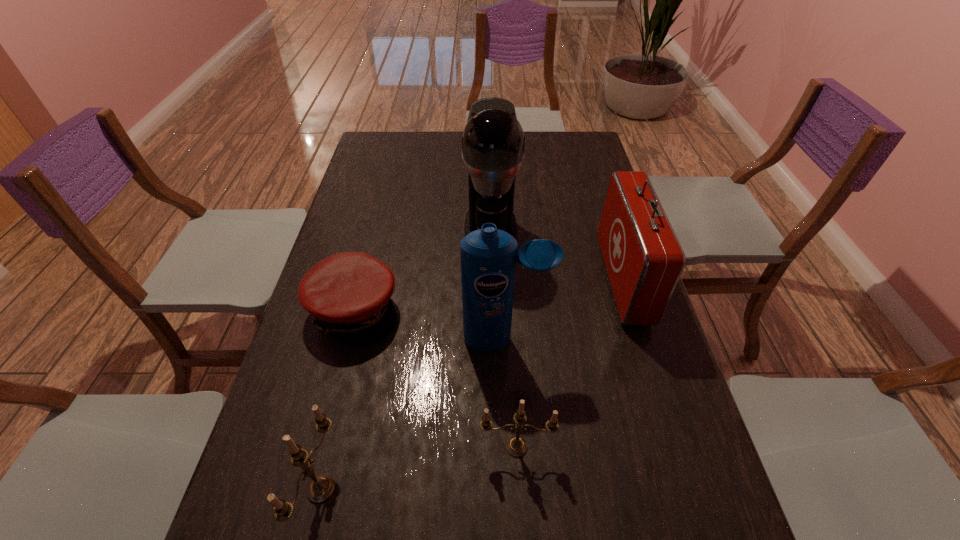
You are a GUI agent. You are given a task and a screenshot of the screen. Output one action in this format:
    pyautogui.click(x=<x>, y=<y>)
    Task: Click on the shorter candle
    The width and height of the screenshot is (960, 540).
    Given the screenshot: What is the action you would take?
    pyautogui.click(x=516, y=446)

Find the location of a particular element. the second shortest object is located at coordinates 516,446.

Where is `coffee maker`? coffee maker is located at coordinates (493, 140).

Find the location of a particular element. This screenshot has width=960, height=540. cap is located at coordinates (348, 293).

This screenshot has height=540, width=960. Find the location of `shampoo`. shampoo is located at coordinates [488, 256].

Locate an element on the screen. The width and height of the screenshot is (960, 540). the fourth shortest object is located at coordinates (644, 260).

You are a GUI agent. You are given a task and a screenshot of the screen. Output one action in this format:
    pyautogui.click(x=<x>, y=<y>)
    Task: Click on the rightmost object
    Image resolution: width=960 pixels, height=540 pixels.
    Given the screenshot: What is the action you would take?
    pyautogui.click(x=644, y=260)

What are the coordinates of `blank space located 0.190m on the left of the right candle` in the screenshot? It's located at (387, 447).

Find the location of a particular element. blank space located place cup under the spout of the coffee maker is located at coordinates (493, 350).

The image size is (960, 540). Identify the location of vacant space located 0.160m at the front of the shortest object where the visor is located. (459, 310).